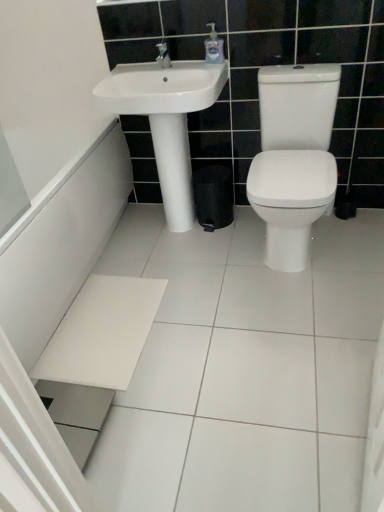
Question: Is white ceramic tile at lower center taller or shorter than clear plastic soap dispenser at upper center?

Choices:
 (A) tall
 (B) short

Answer: (B)

Question: Looking at the image, does white ceramic tile at lower center seem bigger or smaller compared to clear plastic soap dispenser at upper center?

Choices:
 (A) big
 (B) small

Answer: (A)

Question: Which of these objects is positioned closest to the white glossy bath at lower left?

Choices:
 (A) white ceramic tile at lower center
 (B) clear plastic soap dispenser at upper center
 (C) white glossy toilet at right
 (D) white glossy sink at upper center

Answer: (A)

Question: Estimate the real-world distances between objects in this image. Which object is farther from the white glossy bath at lower left?

Choices:
 (A) white glossy toilet at right
 (B) white glossy sink at upper center
 (C) clear plastic soap dispenser at upper center
 (D) white ceramic tile at lower center

Answer: (C)